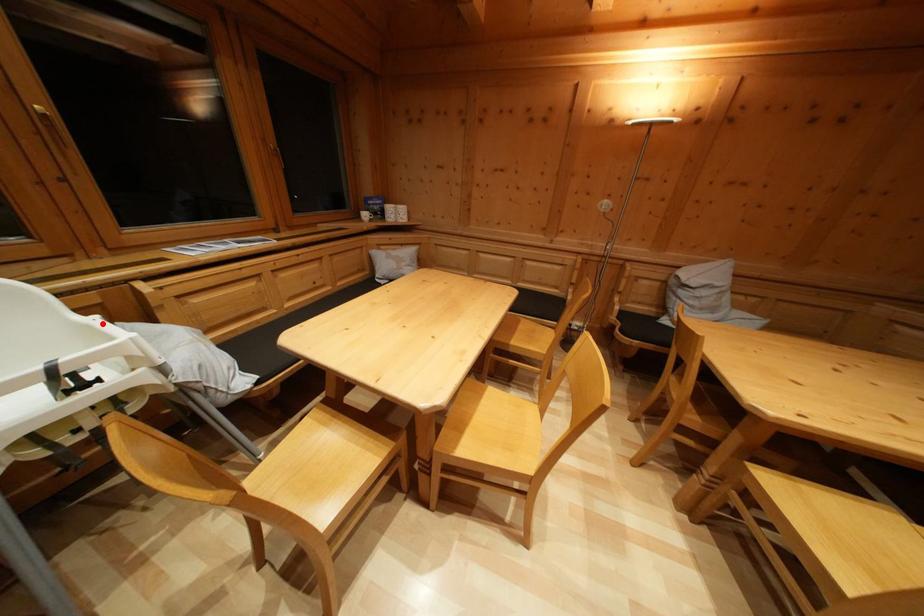
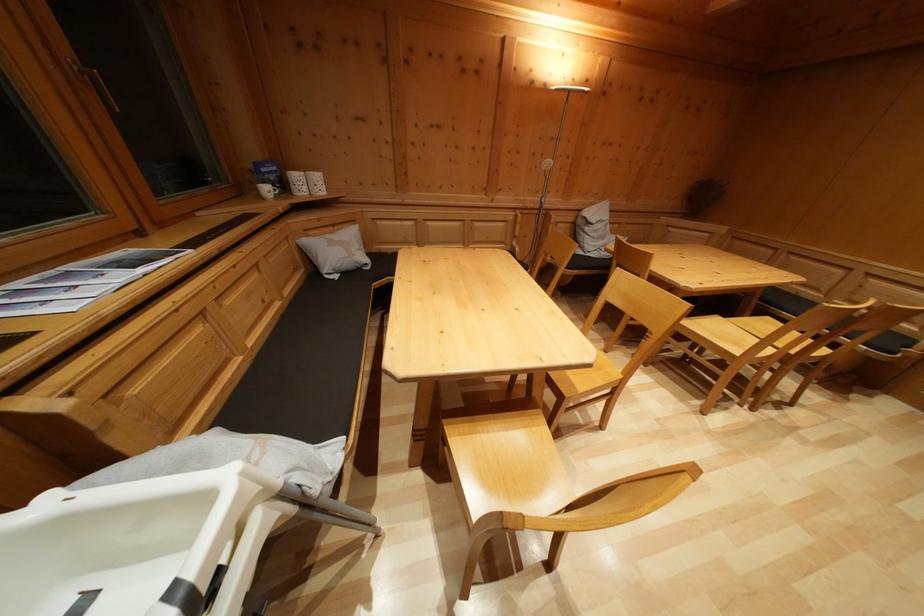
In the second image, find the point that corresponds to the highlighted location in the first image.

(56, 503)